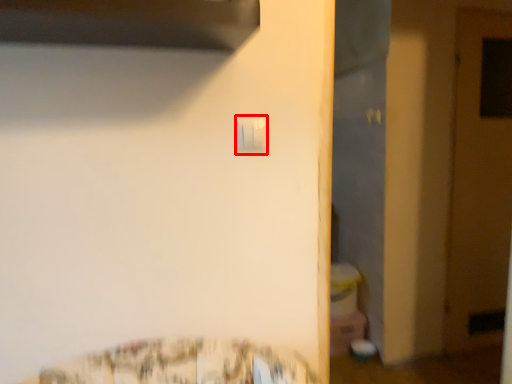
Question: In this image, where is light switch (annotated by the red box) located relative to door?

Choices:
 (A) left
 (B) right

Answer: (A)